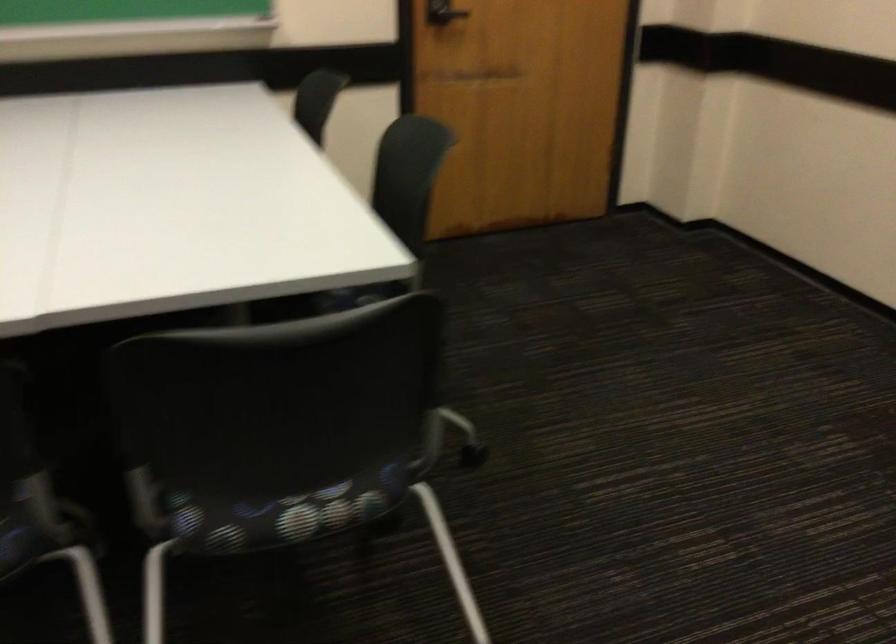
Locate an element on the screen. The width and height of the screenshot is (896, 644). chair sitting surface is located at coordinates (286, 514).